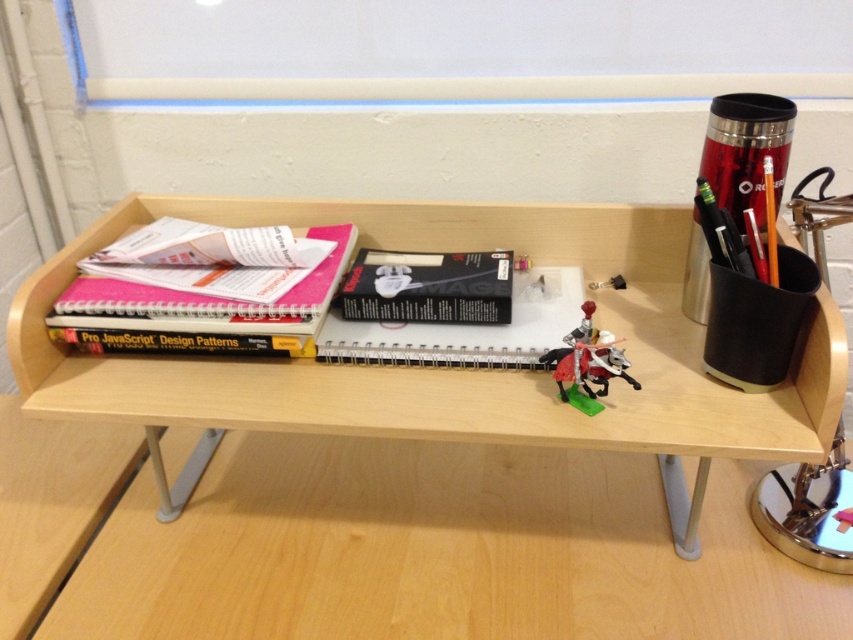
In the scene shown: You are a delivery robot with a width of 20 centimeters. You need to move from the wooden table at center to the metallic silver toy at center. Is there enough space for you to pass through the gap between them?

The distance between the wooden table at center and the metallic silver toy at center is 22.30 centimeters. Since the robot is 20 centimeters wide, there is sufficient space for it to pass through the gap between them.

You are looking at the wooden shelf on the desk. There are two points marked on the shelf. One is at coordinates point (563, 280) and the other at point (578, 352). Which point is closer to you?

Point (563, 280) is closer to you because it is further to the viewer than point (578, 352).